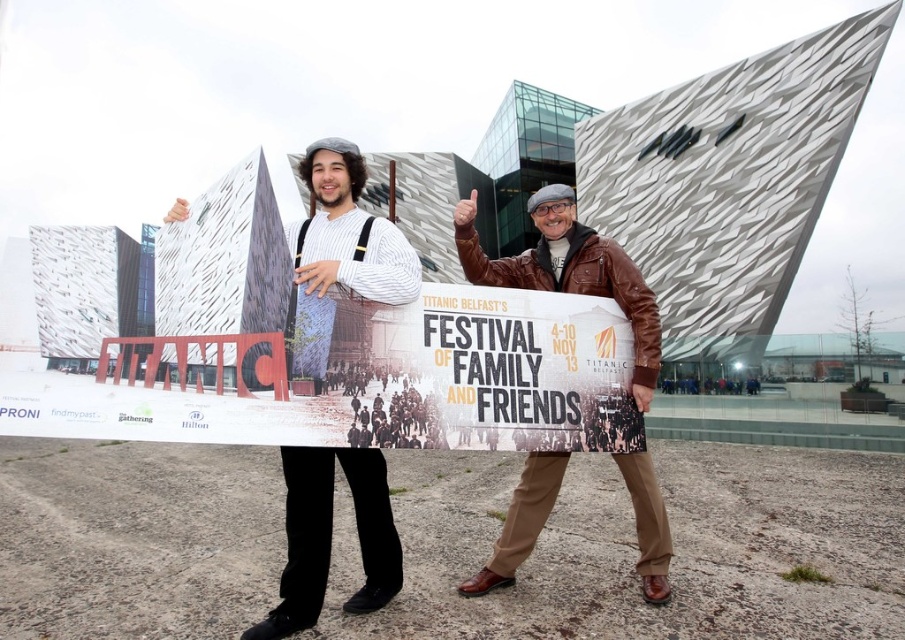
You are a photographer trying to capture both the striped sweater at center and the brown leather jacket at center in a single shot. Based on their positions, which object should you adjust your camera angle to focus on first to ensure both are in frame?

The striped sweater at center is to the left of the brown leather jacket at center, so you should adjust your camera angle to focus on the striped sweater at center first to ensure both are in frame.

You are a photographer positioned in front of the Titanic Belfast promotional poster. You notice two people in the scene wearing a striped sweater at center and a brown leather jacket at center. Which clothing item is positioned closer to you?

The striped sweater at center is closer to the viewer than the brown leather jacket at center.